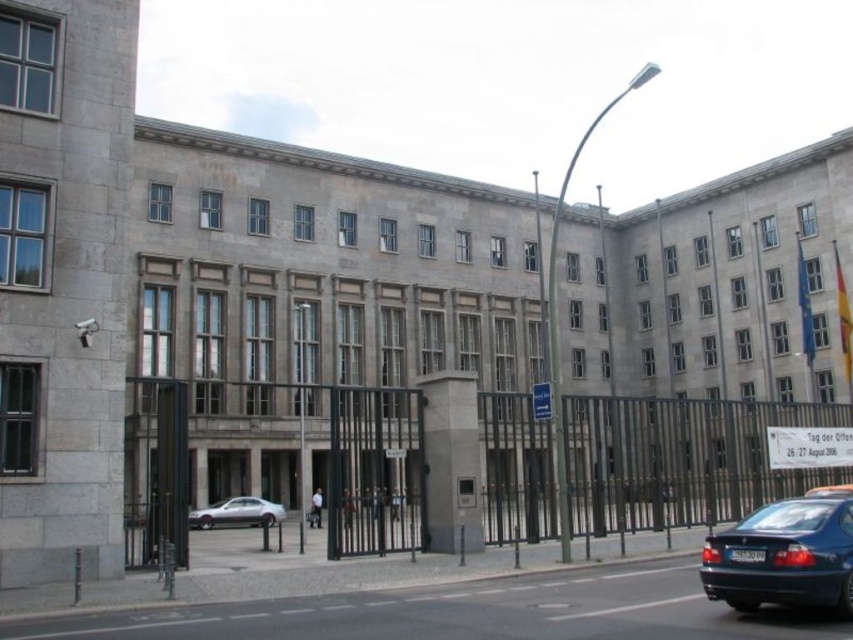
I want to click on silver metallic car at lower left, so click(236, 513).

Which of these two, silver metallic car at lower left or metallic silver taxi at center, stands taller?

metallic silver taxi at center

Which is in front, point (199, 513) or point (815, 492)?

Positioned in front is point (815, 492).

At what (x,y) coordinates should I click in order to perform the action: click on silver metallic car at lower left. Please return your answer as a coordinate pair (x, y). This screenshot has width=853, height=640. Looking at the image, I should click on (236, 513).

Does black metal fence at center appear on the left side of shiny blue sedan at lower right?

Correct, you'll find black metal fence at center to the left of shiny blue sedan at lower right.

Identify the location of black metal fence at center. The height and width of the screenshot is (640, 853). (310, 460).

Is shiny blue sedan at lower right bigger than metallic silver taxi at center?

Actually, shiny blue sedan at lower right might be smaller than metallic silver taxi at center.

The height and width of the screenshot is (640, 853). What do you see at coordinates (784, 556) in the screenshot?
I see `shiny blue sedan at lower right` at bounding box center [784, 556].

Locate an element on the screen. The width and height of the screenshot is (853, 640). shiny blue sedan at lower right is located at coordinates (784, 556).